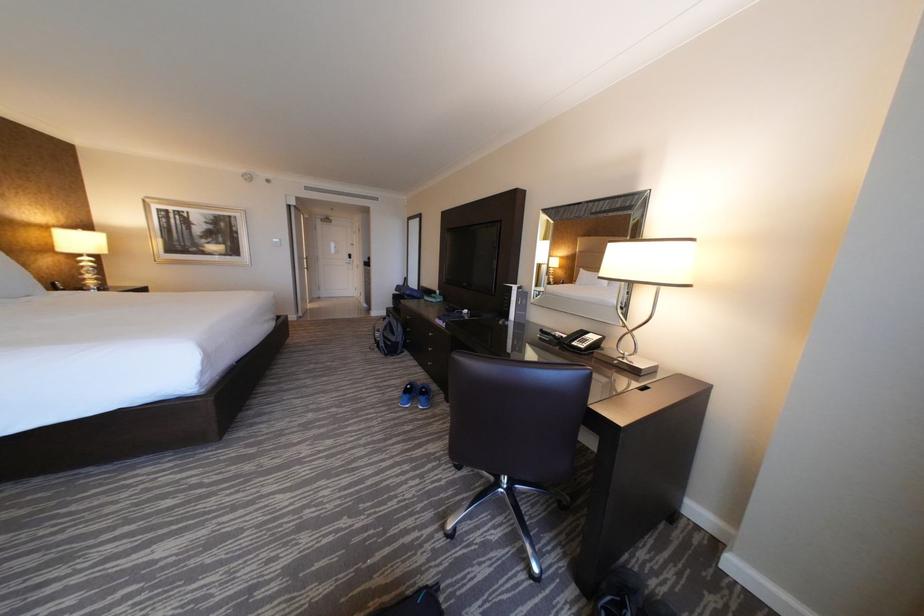
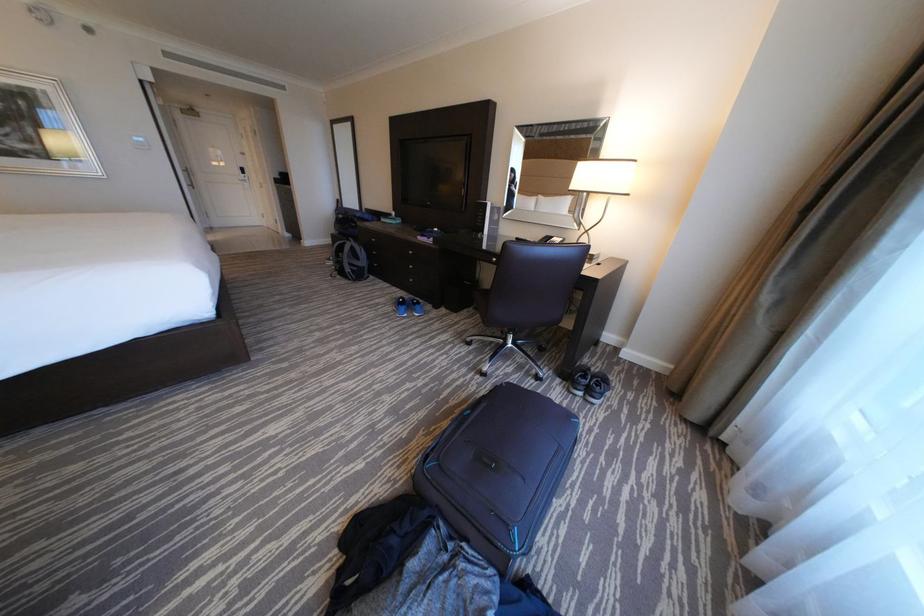
In a continuous first-person perspective shot, in which direction is the camera moving?

The cameraman moved toward left, backward.